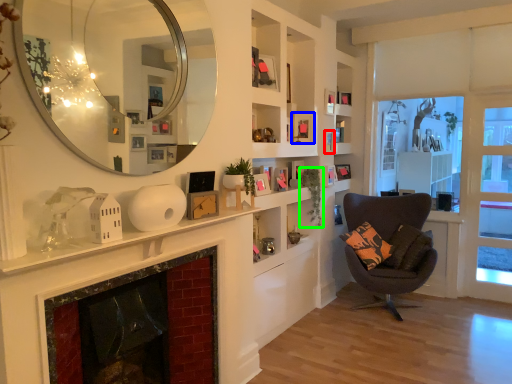
Question: Which is farther away from picture frame (highlighted by a red box)? picture frame (highlighted by a blue box) or plant (highlighted by a green box)?

Choices:
 (A) picture frame
 (B) plant

Answer: (B)